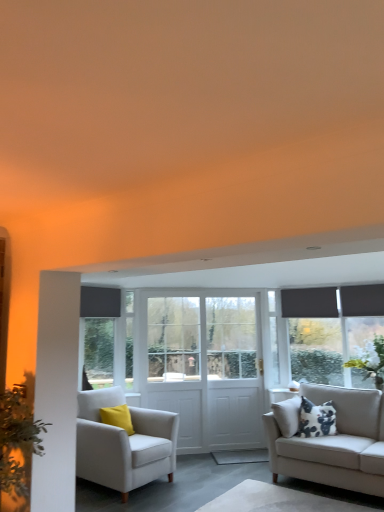
Question: Is white textured plant at right, arranged as the 2th plant when viewed from the front, inside or outside of dark gray roller blind at left?

Choices:
 (A) outside
 (B) inside

Answer: (A)

Question: Considering the positions of white textured plant at right, positioned as the first plant in back-to-front order, and dark gray roller blind at left in the image, is white textured plant at right, positioned as the first plant in back-to-front order, bigger or smaller than dark gray roller blind at left?

Choices:
 (A) big
 (B) small

Answer: (A)

Question: Which object is positioned closest to the green leafy plant at left, which is the second plant in right-to-left order?

Choices:
 (A) white wooden door at center
 (B) dark gray roller blind at left
 (C) white wooden door at center, which is the first screen door in right-to-left order
 (D) white textured plant at right, arranged as the 2th plant when viewed from the front
 (E) white fabric rug at lower center

Answer: (E)

Question: Which object is positioned farthest from the white wooden door at center?

Choices:
 (A) white fabric rug at lower center
 (B) white wooden screen door at center, acting as the 1th screen door starting from the left
 (C) white textured plant at right, the second plant in the left-to-right sequence
 (D) beige fabric couch at right
 (E) white fabric armchair at left

Answer: (C)